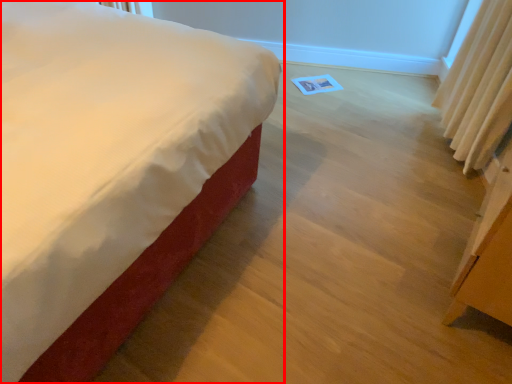
Question: Observing the image, what is the correct spatial positioning of bed (annotated by the red box) in reference to curtain?

Choices:
 (A) right
 (B) left

Answer: (B)